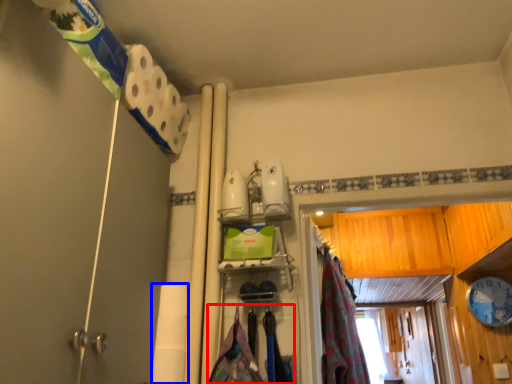
Question: Among these objects, which one is farthest to the camera, laundry (highlighted by a red box) or toilet paper (highlighted by a blue box)?

Choices:
 (A) laundry
 (B) toilet paper

Answer: (B)